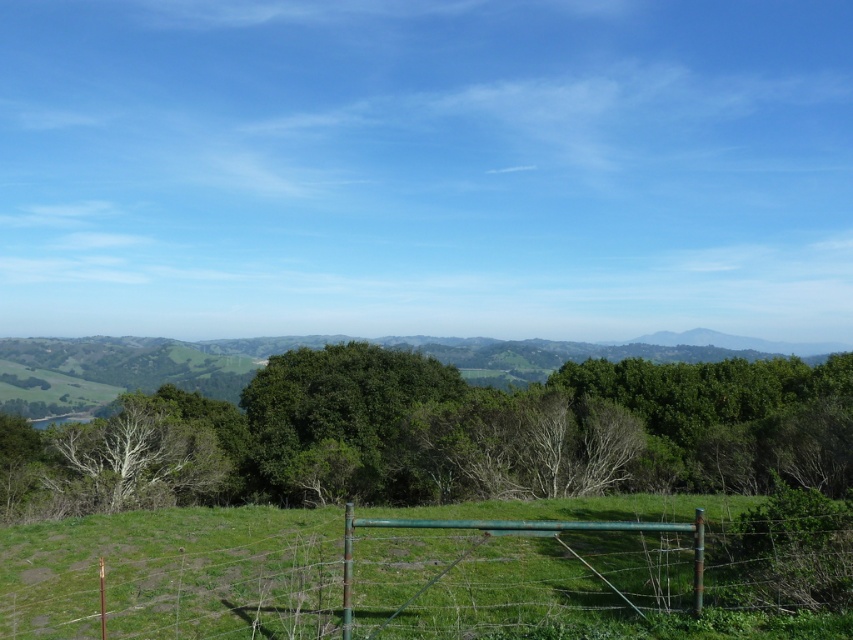
Can you confirm if green leafy tree at center is wider than green metal gate at center?

Yes.

Does green leafy tree at center have a larger size compared to green metal gate at center?

Yes.

Does point (276, 392) come in front of point (144, 621)?

No, it is not.

You are a GUI agent. You are given a task and a screenshot of the screen. Output one action in this format:
    pyautogui.click(x=<x>, y=<y>)
    Task: Click on the green leafy tree at center
    
    Given the screenshot: What is the action you would take?
    pyautogui.click(x=440, y=435)